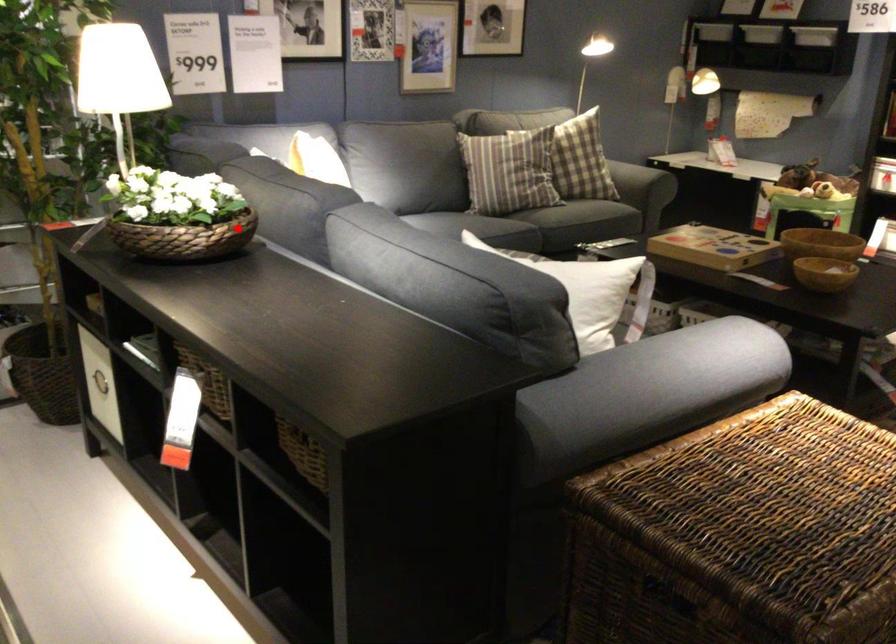
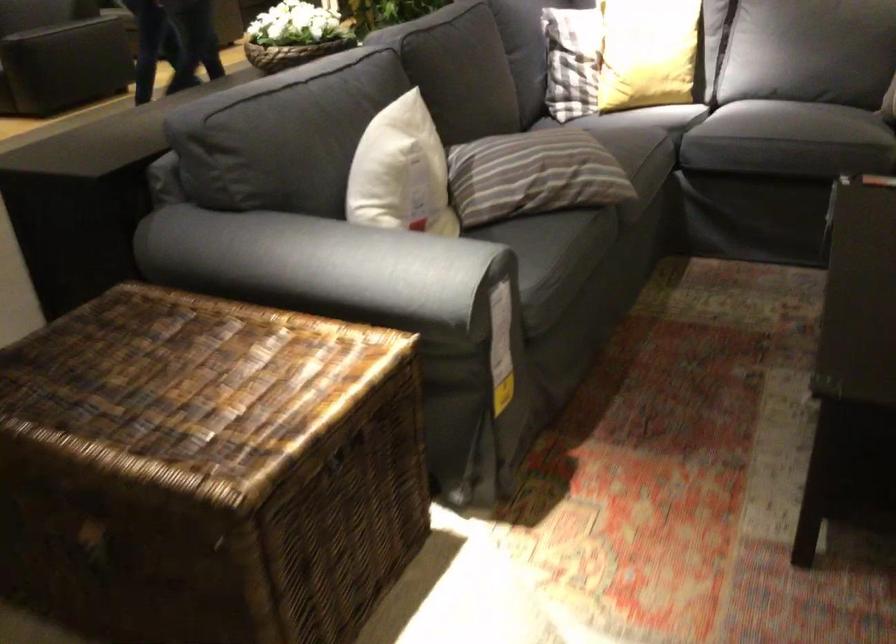
Find the pixel in the second image that matches the highlighted location in the first image.

(291, 53)